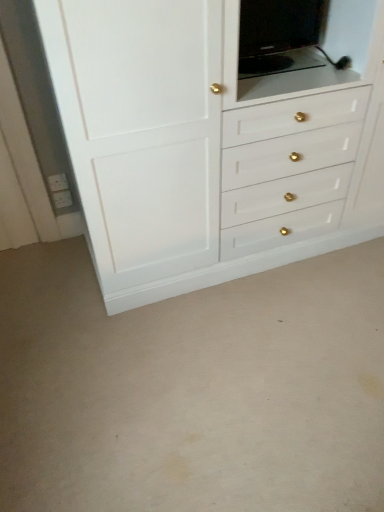
Question: Is white glossy cabinet at upper center shorter than black glossy tv at upper center?

Choices:
 (A) yes
 (B) no

Answer: (B)

Question: From the image's perspective, would you say white glossy cabinet at upper center is shown under black glossy tv at upper center?

Choices:
 (A) yes
 (B) no

Answer: (A)

Question: From a real-world perspective, is white glossy cabinet at upper center below black glossy tv at upper center?

Choices:
 (A) yes
 (B) no

Answer: (A)

Question: Considering the relative positions of white glossy cabinet at upper center and black glossy tv at upper center in the image provided, is white glossy cabinet at upper center to the left of black glossy tv at upper center from the viewer's perspective?

Choices:
 (A) no
 (B) yes

Answer: (A)

Question: Is white glossy cabinet at upper center looking in the opposite direction of black glossy tv at upper center?

Choices:
 (A) no
 (B) yes

Answer: (B)

Question: Does white glossy cabinet at upper center lie behind black glossy tv at upper center?

Choices:
 (A) yes
 (B) no

Answer: (B)

Question: Is black glossy tv at upper center at the right side of white glossy cabinet at upper center?

Choices:
 (A) no
 (B) yes

Answer: (A)

Question: From a real-world perspective, is black glossy tv at upper center over white glossy cabinet at upper center?

Choices:
 (A) no
 (B) yes

Answer: (B)

Question: Is black glossy tv at upper center shorter than white glossy cabinet at upper center?

Choices:
 (A) no
 (B) yes

Answer: (B)

Question: Considering the relative sizes of black glossy tv at upper center and white glossy cabinet at upper center in the image provided, is black glossy tv at upper center taller than white glossy cabinet at upper center?

Choices:
 (A) yes
 (B) no

Answer: (B)

Question: Considering the relative sizes of black glossy tv at upper center and white glossy cabinet at upper center in the image provided, is black glossy tv at upper center smaller than white glossy cabinet at upper center?

Choices:
 (A) yes
 (B) no

Answer: (A)

Question: Would you say black glossy tv at upper center is a long distance from white glossy cabinet at upper center?

Choices:
 (A) no
 (B) yes

Answer: (A)

Question: Considering the relative positions of black glossy tv at upper center and white glossy cabinet at upper center in the image provided, is black glossy tv at upper center to the left or to the right of white glossy cabinet at upper center?

Choices:
 (A) left
 (B) right

Answer: (A)